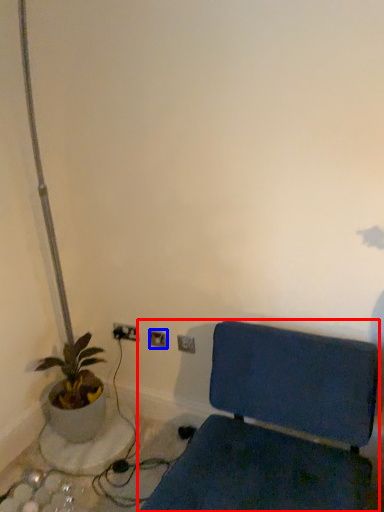
Question: Which object is closer to the camera taking this photo, furniture (highlighted by a red box) or electric outlet (highlighted by a blue box)?

Choices:
 (A) furniture
 (B) electric outlet

Answer: (A)